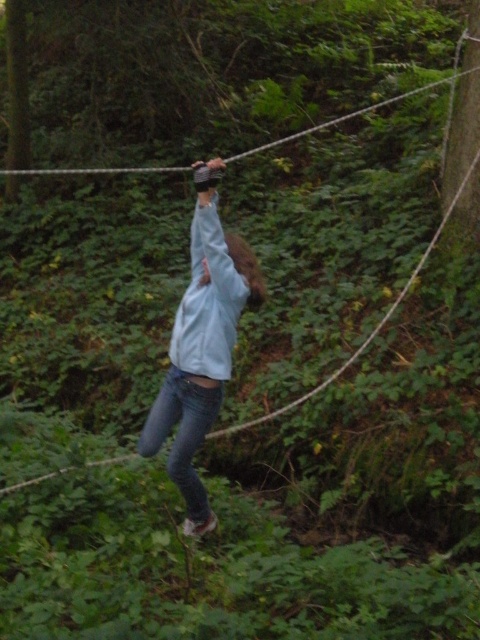
Question: Among these objects, which one is farthest from the camera?

Choices:
 (A) denim at center
 (B) light blue fabric at center

Answer: (A)

Question: Which point is closer to the camera?

Choices:
 (A) (222, 304)
 (B) (201, 513)

Answer: (A)

Question: Can you confirm if light blue fabric at center is thinner than denim at center?

Choices:
 (A) no
 (B) yes

Answer: (A)

Question: Does light blue fabric at center have a greater width compared to denim at center?

Choices:
 (A) no
 (B) yes

Answer: (B)

Question: Is light blue fabric at center below denim at center?

Choices:
 (A) yes
 (B) no

Answer: (B)